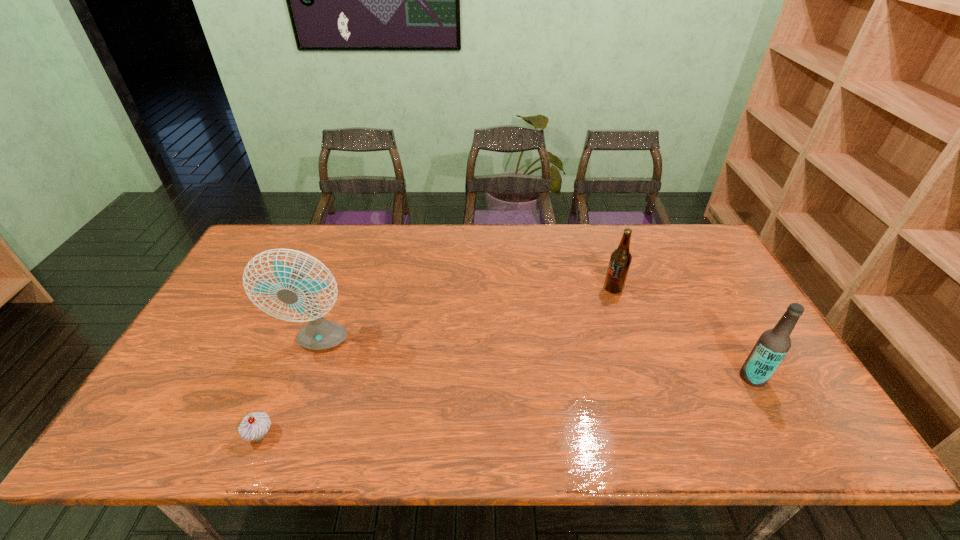
In order to click on free space between the cupcake and the second object from right to left in this screenshot , I will do `click(437, 362)`.

I want to click on free spot between the second nearest object and the shortest object, so click(x=506, y=406).

Locate an element on the screen. This screenshot has width=960, height=540. vacant area that lies between the farther beer bottle and the nearest object is located at coordinates (437, 362).

The height and width of the screenshot is (540, 960). I want to click on empty space that is in between the fan and the third farthest object, so click(x=536, y=360).

Identify which object is the third nearest to the right beer bottle. Please provide its 2D coordinates. Your answer should be formatted as a tuple, i.e. [(x, y)], where the tuple contains the x and y coordinates of a point satisfying the conditions above.

[(255, 426)]

This screenshot has height=540, width=960. Find the location of `object that is the closest one to the farthest object`. object that is the closest one to the farthest object is located at coordinates (773, 344).

This screenshot has height=540, width=960. In order to click on free spot that satisfies the following two spatial constraints: 1. on the label of the second object from right to left; 2. on the front side of the cupcake in this screenshot , I will do `click(662, 435)`.